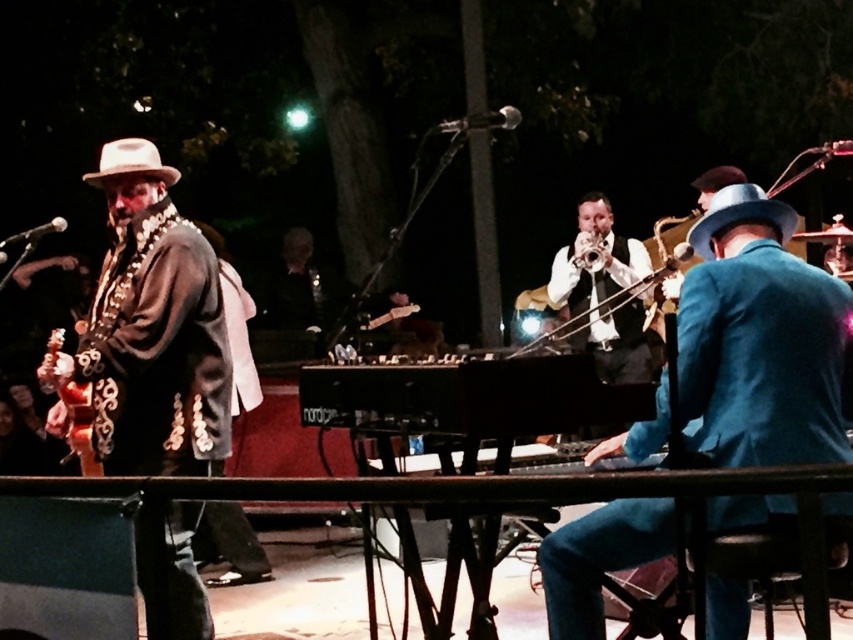
Question: Which point is farther to the camera?

Choices:
 (A) light beige felt fedora at left
 (B) blue velvet suit at center

Answer: (A)

Question: Observing the image, what is the correct spatial positioning of blue velvet suit at center in reference to blue felt hat at right?

Choices:
 (A) above
 (B) below

Answer: (B)

Question: Does leather jacket at left lie in front of blue felt hat at right?

Choices:
 (A) no
 (B) yes

Answer: (A)

Question: In this image, where is leather jacket at left located relative to shiny brass trumpet at center?

Choices:
 (A) below
 (B) above

Answer: (A)

Question: Which is farther from the blue felt hat at right?

Choices:
 (A) black polished piano at center
 (B) leather jacket at left
 (C) silver metallic trumpet at center
 (D) shiny brass trumpet at center

Answer: (B)

Question: Which object is farther from the camera taking this photo?

Choices:
 (A) blue felt hat at right
 (B) light beige felt fedora at left
 (C) leather jacket at left
 (D) blue velvet suit at center

Answer: (B)